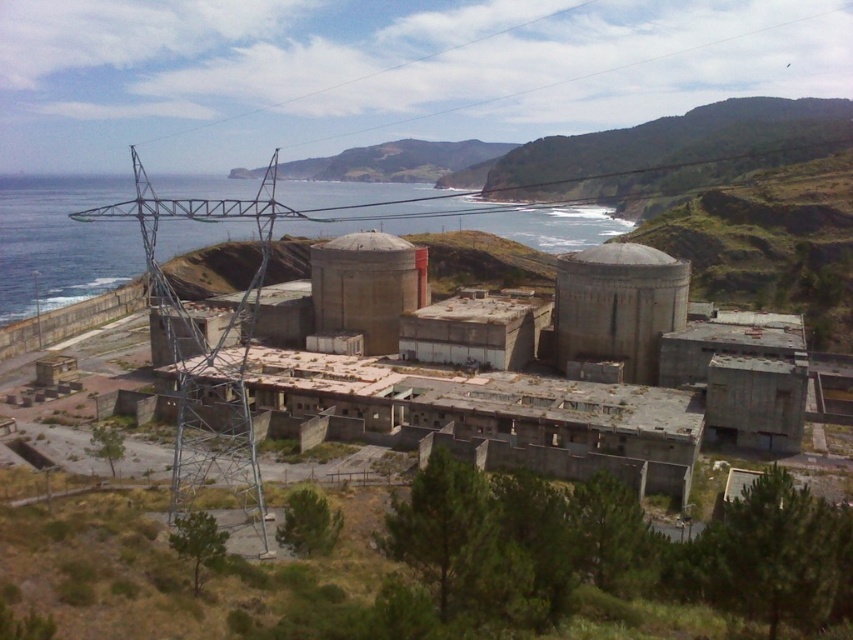
Question: Among these objects, which one is farthest from the camera?

Choices:
 (A) concrete dome at center-right
 (B) green grassy hillside at upper center

Answer: (B)

Question: Is blue water at center below green grassy hillside at upper center?

Choices:
 (A) yes
 (B) no

Answer: (A)

Question: Can you confirm if concrete dome at center-right is positioned to the left of concrete silo at center?

Choices:
 (A) yes
 (B) no

Answer: (B)

Question: Which object is closer to the camera taking this photo?

Choices:
 (A) green grassy hillside at upper center
 (B) concrete dome at center-right
 (C) blue water at center

Answer: (B)

Question: Is concrete dome at center-right in front of green grassy hillside at upper center?

Choices:
 (A) yes
 (B) no

Answer: (A)

Question: Which point appears closest to the camera in this image?

Choices:
 (A) (657, 298)
 (B) (341, 289)

Answer: (A)